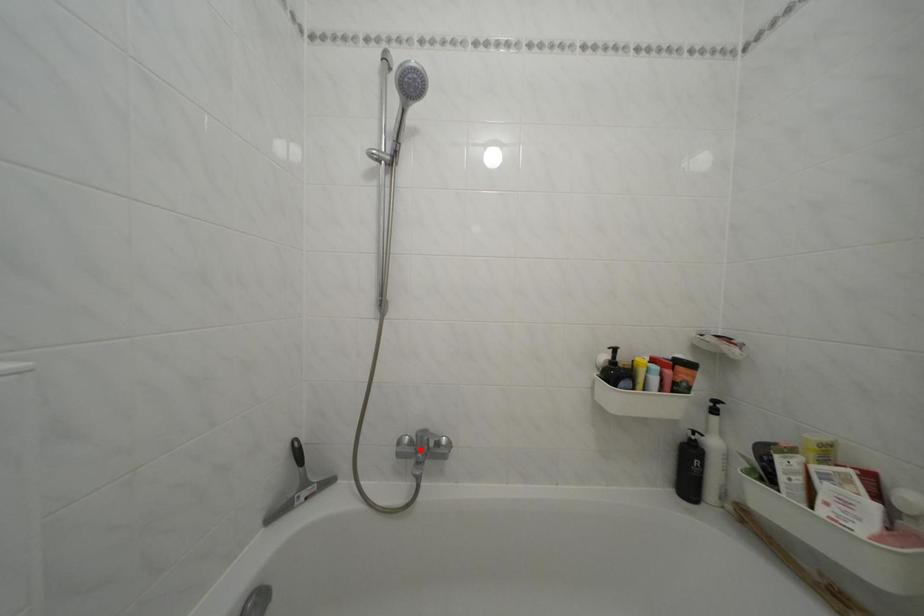
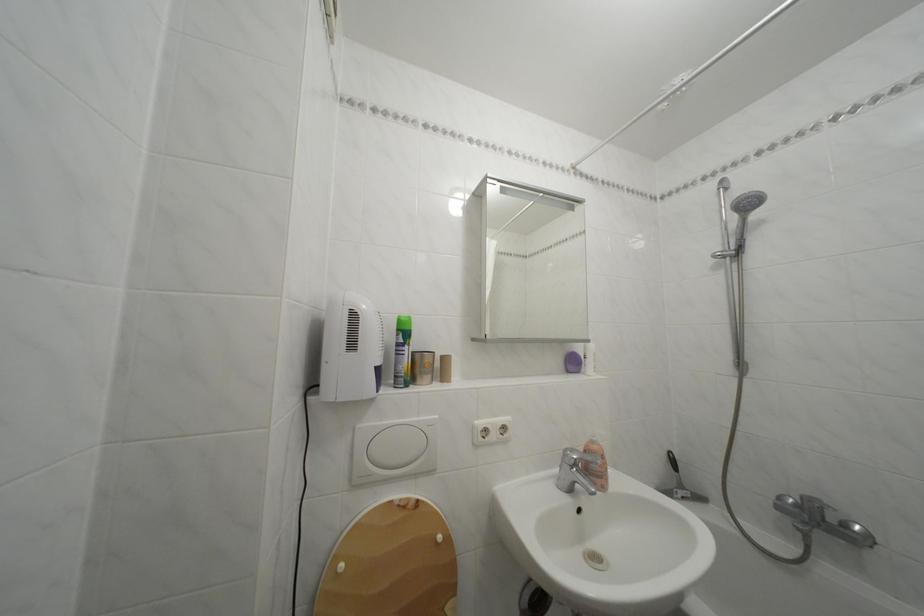
Question: I am providing you with two images of the same scene from different viewpoints. In image1, a red point is highlighted. Considering the same 3D point in image2, which of the following is correct?

Choices:
 (A) It is closer
 (B) It is farther

Answer: (A)